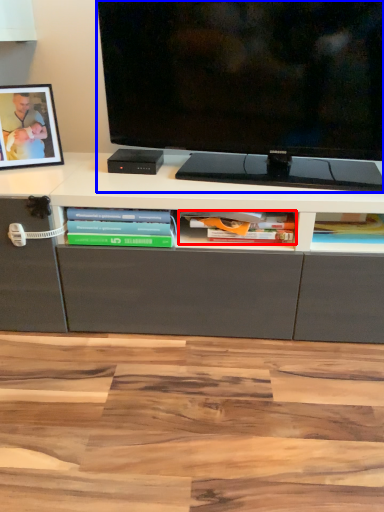
Question: Which object is closer to the camera taking this photo, book (highlighted by a red box) or television (highlighted by a blue box)?

Choices:
 (A) book
 (B) television

Answer: (B)